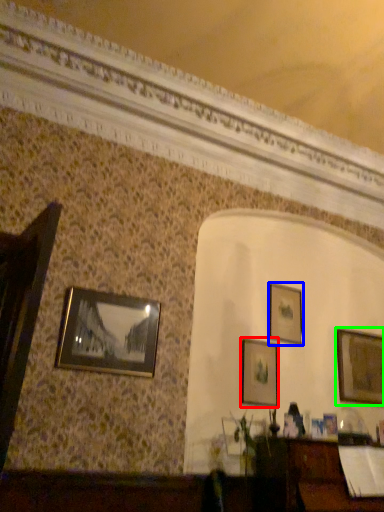
Question: Which object is positioned closest to picture frame (highlighted by a red box)? Select from picture frame (highlighted by a blue box) and picture frame (highlighted by a green box).

Choices:
 (A) picture frame
 (B) picture frame

Answer: (A)